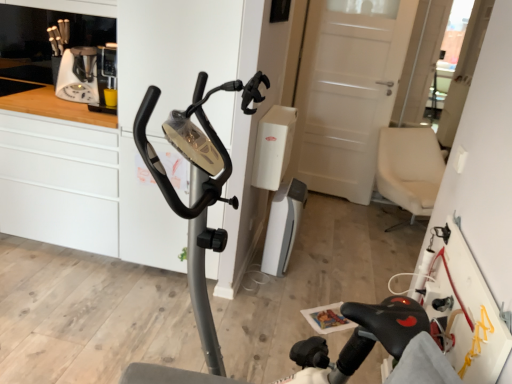
What do you see at coordinates (126, 137) in the screenshot? The image size is (512, 384). I see `white glossy dresser at center` at bounding box center [126, 137].

You are a GUI agent. You are given a task and a screenshot of the screen. Output one action in this format:
    pyautogui.click(x=<x>, y=<y>)
    Task: Click on the white plastic vacuum cleaner at center
    Image resolution: width=512 pixels, height=384 pixels.
    Given the screenshot: What is the action you would take?
    pyautogui.click(x=283, y=226)

Where is `metallic gray stationary bicycle at center`? Image resolution: width=512 pixels, height=384 pixels. metallic gray stationary bicycle at center is located at coordinates (194, 223).

Where is `white matte cabinet at left`? This screenshot has height=384, width=512. white matte cabinet at left is located at coordinates (59, 184).

The height and width of the screenshot is (384, 512). Identify the location of white glossy dresser at center. (126, 137).

Is metallic gray stationary bicycle at center positioned in front of white matte cabinet at left?

Yes, metallic gray stationary bicycle at center is in front of white matte cabinet at left.

Which of these two, metallic gray stationary bicycle at center or white matte cabinet at left, stands shorter?

Standing shorter between the two is white matte cabinet at left.

Can you confirm if metallic gray stationary bicycle at center is thinner than white matte cabinet at left?

Incorrect, the width of metallic gray stationary bicycle at center is not less than that of white matte cabinet at left.

Between white plastic coffee machine at upper left and white plastic vacuum cleaner at center, which one has smaller size?

white plastic coffee machine at upper left.

From a real-world perspective, is white plastic coffee machine at upper left physically located above or below white plastic vacuum cleaner at center?

white plastic coffee machine at upper left is situated higher than white plastic vacuum cleaner at center in the real world.

Who is taller, white plastic coffee machine at upper left or white plastic vacuum cleaner at center?

white plastic vacuum cleaner at center.

Considering the points (94, 61) and (286, 210), which point is behind, point (94, 61) or point (286, 210)?

The point (286, 210) is more distant.

Considering the positions of objects metallic gray stationary bicycle at center and white plastic vacuum cleaner at center in the image provided, who is behind, metallic gray stationary bicycle at center or white plastic vacuum cleaner at center?

white plastic vacuum cleaner at center is further from the camera.

From a real-world perspective, is metallic gray stationary bicycle at center on white plastic vacuum cleaner at center?

Yes.

Looking at this image, considering the sizes of objects metallic gray stationary bicycle at center and white plastic vacuum cleaner at center in the image provided, who is thinner, metallic gray stationary bicycle at center or white plastic vacuum cleaner at center?

With smaller width is white plastic vacuum cleaner at center.

Is metallic gray stationary bicycle at center far from white plastic vacuum cleaner at center?

Yes, metallic gray stationary bicycle at center and white plastic vacuum cleaner at center are located far from each other.

Looking at this image, can you confirm if white plastic vacuum cleaner at center is wider than metallic gray stationary bicycle at center?

No.

This screenshot has width=512, height=384. Find the location of `appliance behind the metallic gray stationary bicycle at center`. appliance behind the metallic gray stationary bicycle at center is located at coordinates (283, 226).

From a real-world perspective, which is physically below, white plastic vacuum cleaner at center or metallic gray stationary bicycle at center?

white plastic vacuum cleaner at center, from a real-world perspective.

In the scene shown: Is white plastic vacuum cleaner at center spatially inside metallic gray stationary bicycle at center, or outside of it?

white plastic vacuum cleaner at center lies outside metallic gray stationary bicycle at center.

From the image's perspective, which one is positioned higher, white matte cabinet at left or white plastic vacuum cleaner at center?

white matte cabinet at left is shown above in the image.

Is white matte cabinet at left oriented towards white plastic vacuum cleaner at center?

No, white matte cabinet at left does not turn towards white plastic vacuum cleaner at center.

Which point is more distant from viewer, (x=24, y=202) or (x=282, y=191)?

The point (x=282, y=191) is more distant.

Identify the location of appliance behind the white matte cabinet at left. (283, 226).

Relative to white glossy dresser at center, is white plastic vacuum cleaner at center in front or behind?

white plastic vacuum cleaner at center is positioned farther from the viewer than white glossy dresser at center.

Is white plastic vacuum cleaner at center beside white glossy dresser at center?

white plastic vacuum cleaner at center and white glossy dresser at center are clearly separated.

Where is `appliance on the right side of white glossy dresser at center`? The image size is (512, 384). appliance on the right side of white glossy dresser at center is located at coordinates (283, 226).

Is white plastic vacuum cleaner at center bigger or smaller than white glossy dresser at center?

Considering their sizes, white plastic vacuum cleaner at center takes up less space than white glossy dresser at center.

From the picture: Can you tell me how much white matte cabinet at left and metallic gray stationary bicycle at center differ in facing direction?

They differ by 89.3 degrees in their facing directions.

Is white matte cabinet at left not inside metallic gray stationary bicycle at center?

That's correct, white matte cabinet at left is outside of metallic gray stationary bicycle at center.

Where is `stationary bicycle that is on the right side of white matte cabinet at left`? stationary bicycle that is on the right side of white matte cabinet at left is located at coordinates click(194, 223).

From a real-world perspective, which is physically above, white matte cabinet at left or metallic gray stationary bicycle at center?

metallic gray stationary bicycle at center.

Find the location of `cabinetry located behind the metallic gray stationary bicycle at center`. cabinetry located behind the metallic gray stationary bicycle at center is located at coordinates (59, 184).

You are a GUI agent. You are given a task and a screenshot of the screen. Output one action in this format:
    pyautogui.click(x=<x>, y=<y>)
    Task: Click on the appliance on the right of white plastic coffee machine at upper left
    The height and width of the screenshot is (384, 512).
    Given the screenshot: What is the action you would take?
    pyautogui.click(x=283, y=226)

When comparing their distances from white glossy dresser at center, does white plastic coffee machine at upper left or metallic gray stationary bicycle at center seem further?

metallic gray stationary bicycle at center is positioned further to the anchor white glossy dresser at center.

Which object lies further to the anchor point white plastic coffee machine at upper left, white glossy dresser at center or white matte cabinet at left?

white glossy dresser at center is positioned further to the anchor white plastic coffee machine at upper left.

Looking at the image, which one is located closer to white matte cabinet at left, metallic gray stationary bicycle at center or white plastic vacuum cleaner at center?

white plastic vacuum cleaner at center lies closer to white matte cabinet at left than the other object.

Estimate the real-world distances between objects in this image. Which object is further from white matte cabinet at left, white glossy dresser at center or white plastic vacuum cleaner at center?

white plastic vacuum cleaner at center.

From the picture: From the image, which object appears to be nearer to white plastic vacuum cleaner at center, white glossy dresser at center or metallic gray stationary bicycle at center?

Among the two, white glossy dresser at center is located nearer to white plastic vacuum cleaner at center.

Looking at the image, which one is located further to white plastic vacuum cleaner at center, white glossy dresser at center or white plastic coffee machine at upper left?

The object further to white plastic vacuum cleaner at center is white plastic coffee machine at upper left.

Estimate the real-world distances between objects in this image. Which object is closer to white matte cabinet at left, white plastic vacuum cleaner at center or metallic gray stationary bicycle at center?

The object closer to white matte cabinet at left is white plastic vacuum cleaner at center.

Considering their positions, is white matte cabinet at left positioned closer to white plastic vacuum cleaner at center than metallic gray stationary bicycle at center?

white matte cabinet at left.

The width and height of the screenshot is (512, 384). In order to click on coffee machine between white matte cabinet at left and white glossy dresser at center from left to right in this screenshot , I will do `click(78, 75)`.

Locate an element on the screen. coffee machine between metallic gray stationary bicycle at center and white plastic vacuum cleaner at center along the z-axis is located at coordinates (78, 75).

The height and width of the screenshot is (384, 512). I want to click on cabinetry between metallic gray stationary bicycle at center and white plastic coffee machine at upper left in the front-back direction, so click(59, 184).

You are a GUI agent. You are given a task and a screenshot of the screen. Output one action in this format:
    pyautogui.click(x=<x>, y=<y>)
    Task: Click on the coffee machine located between white matte cabinet at left and white plastic vacuum cleaner at center in the left-right direction
    This screenshot has height=384, width=512.
    Given the screenshot: What is the action you would take?
    pyautogui.click(x=78, y=75)